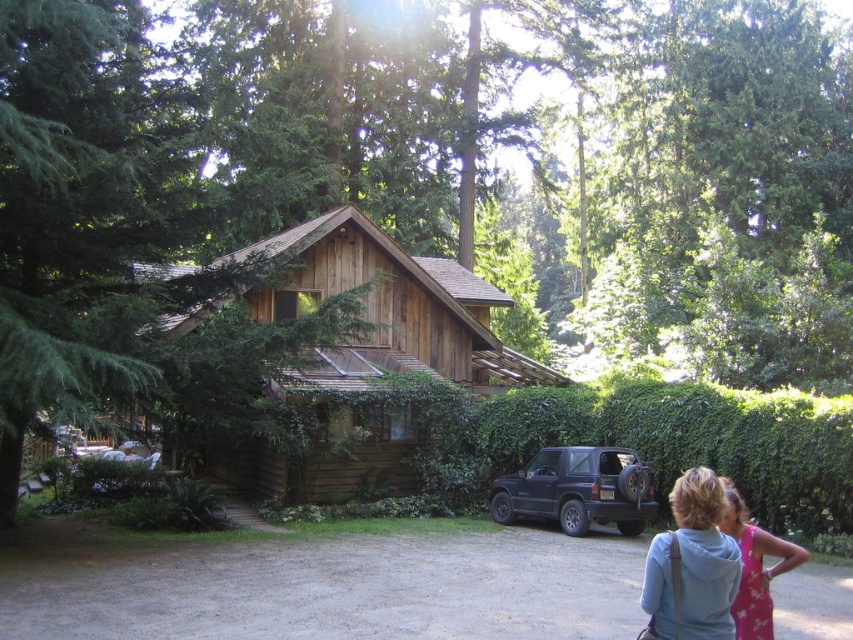
Question: Is dirt/gravel driveway at lower center closer to the viewer compared to matte black suv at lower center?

Choices:
 (A) yes
 (B) no

Answer: (A)

Question: Which point appears farthest from the camera in this image?

Choices:
 (A) (611, 460)
 (B) (259, 572)
 (C) (689, 572)
 (D) (808, 557)

Answer: (A)

Question: Is wooden cabin at center to the right of pink floral dress at lower right from the viewer's perspective?

Choices:
 (A) yes
 (B) no

Answer: (B)

Question: Which point is farther from the camera taking this photo?

Choices:
 (A) (749, 636)
 (B) (813, 634)

Answer: (B)

Question: Is pink fabric at lower right wider than pink floral dress at lower right?

Choices:
 (A) no
 (B) yes

Answer: (A)

Question: Which point is closer to the camera?

Choices:
 (A) (685, 604)
 (B) (466, 611)
 (C) (752, 540)

Answer: (A)